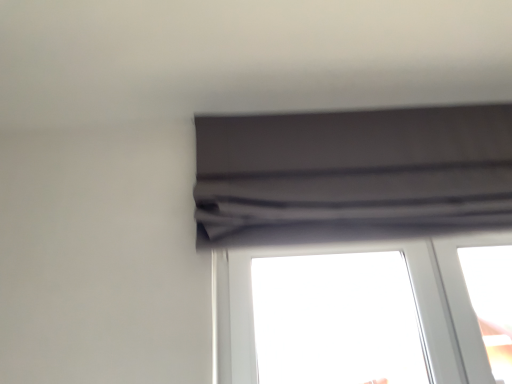
Question: Is matte gray curtain at upper center not close to transparent glass window at center?

Choices:
 (A) no
 (B) yes

Answer: (A)

Question: Is matte gray curtain at upper center closer to camera compared to transparent glass window at center?

Choices:
 (A) no
 (B) yes

Answer: (B)

Question: Considering the relative sizes of matte gray curtain at upper center and transparent glass window at center in the image provided, is matte gray curtain at upper center taller than transparent glass window at center?

Choices:
 (A) yes
 (B) no

Answer: (A)

Question: Is matte gray curtain at upper center with transparent glass window at center?

Choices:
 (A) no
 (B) yes

Answer: (A)

Question: Considering the relative sizes of matte gray curtain at upper center and transparent glass window at center in the image provided, is matte gray curtain at upper center bigger than transparent glass window at center?

Choices:
 (A) yes
 (B) no

Answer: (A)

Question: From a real-world perspective, is matte gray curtain at upper center located beneath transparent glass window at center?

Choices:
 (A) no
 (B) yes

Answer: (A)

Question: Is matte gray curtain at upper center at the back of transparent glass window at center?

Choices:
 (A) no
 (B) yes

Answer: (A)

Question: Is transparent glass window at center positioned before matte gray curtain at upper center?

Choices:
 (A) yes
 (B) no

Answer: (B)

Question: From the image's perspective, is transparent glass window at center located above matte gray curtain at upper center?

Choices:
 (A) no
 (B) yes

Answer: (A)

Question: Would you say transparent glass window at center is a long distance from matte gray curtain at upper center?

Choices:
 (A) yes
 (B) no

Answer: (B)

Question: From a real-world perspective, is transparent glass window at center over matte gray curtain at upper center?

Choices:
 (A) no
 (B) yes

Answer: (A)

Question: From a real-world perspective, is transparent glass window at center beneath matte gray curtain at upper center?

Choices:
 (A) no
 (B) yes

Answer: (B)

Question: Is transparent glass window at center wider or thinner than matte gray curtain at upper center?

Choices:
 (A) thin
 (B) wide

Answer: (A)